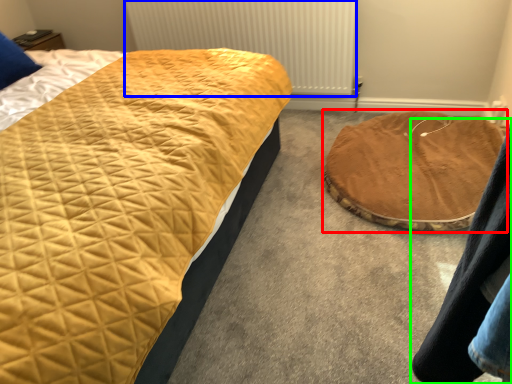
Question: Which object is the farthest from cat bed (highlighted by a red box)? Choose among these: radiator (highlighted by a blue box) or couple (highlighted by a green box).

Choices:
 (A) radiator
 (B) couple

Answer: (B)